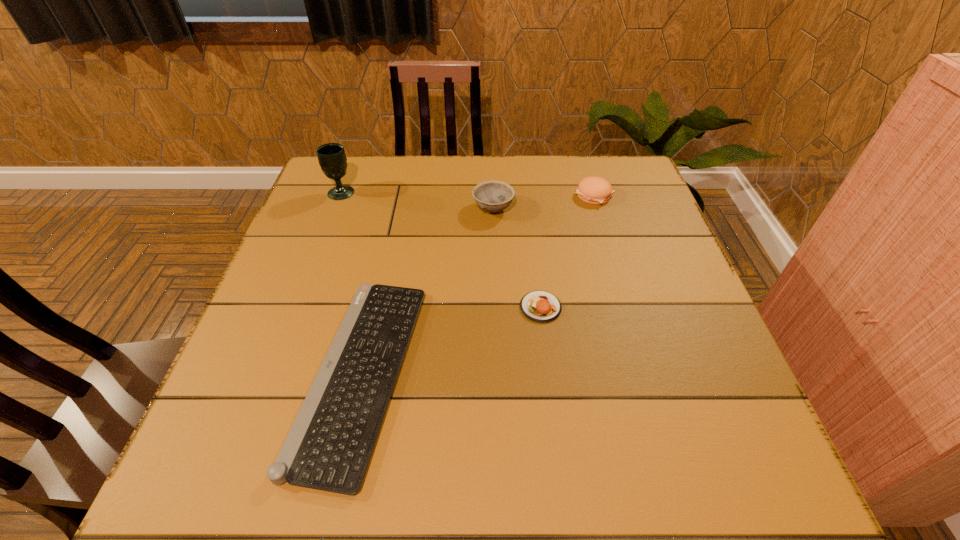
Where is `the tallest object`? The image size is (960, 540). the tallest object is located at coordinates (332, 159).

You are a GUI agent. You are given a task and a screenshot of the screen. Output one action in this format:
    pyautogui.click(x=<x>, y=<y>)
    Task: Click on the chalice
    The height and width of the screenshot is (540, 960).
    Given the screenshot: What is the action you would take?
    pyautogui.click(x=332, y=159)

Where is `bowl`? bowl is located at coordinates (493, 196).

At what (x,y) coordinates should I click in order to perform the action: click on the taller patty (food). Please return your answer as a coordinate pair (x, y). The image size is (960, 540). Looking at the image, I should click on (594, 190).

Identify the location of the third shortest object. The image size is (960, 540). (594, 190).

Identify the location of the left patty (food). Image resolution: width=960 pixels, height=540 pixels. (539, 306).

Identify the location of the nearer patty (food). (539, 306).

Where is `computer keyboard`? The width and height of the screenshot is (960, 540). computer keyboard is located at coordinates (329, 446).

Image resolution: width=960 pixels, height=540 pixels. I want to click on vacant space located on the back of the tallest object, so click(x=351, y=166).

Locate an element on the screen. vacant position located 0.240m on the left of the bowl is located at coordinates (385, 208).